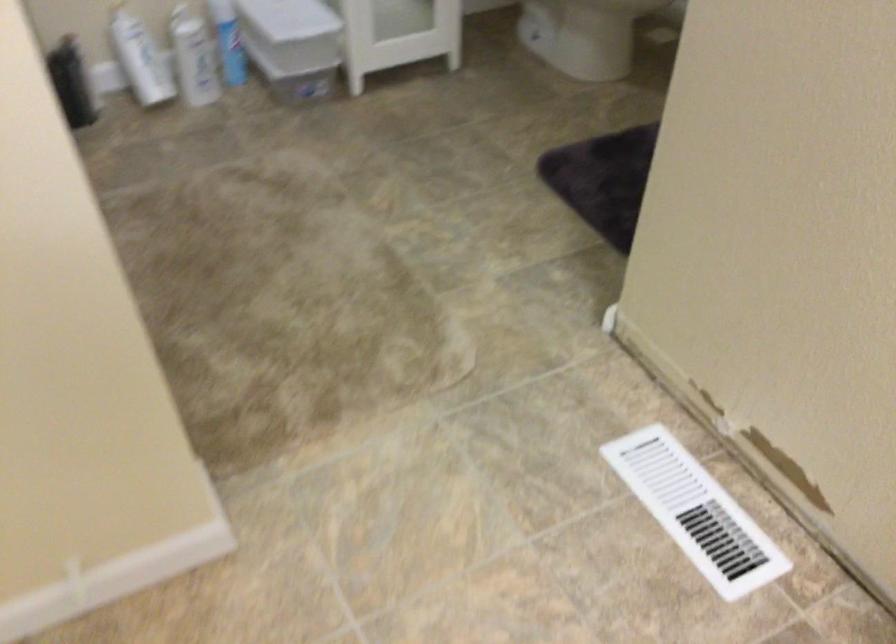
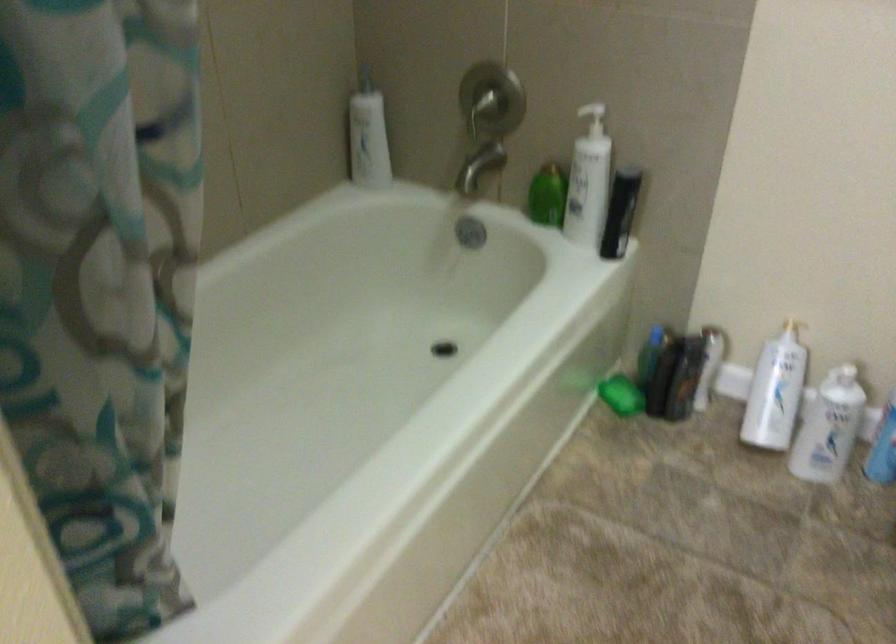
Question: The images are taken continuously from a first-person perspective. In which direction is your viewpoint rotating?

Choices:
 (A) Left
 (B) Right
 (C) Up
 (D) Down

Answer: (A)